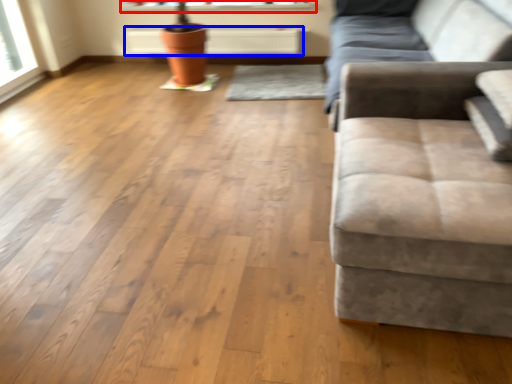
Question: Among these objects, which one is nearest to the camera, window sill (highlighted by a red box) or radiator (highlighted by a blue box)?

Choices:
 (A) window sill
 (B) radiator

Answer: (B)